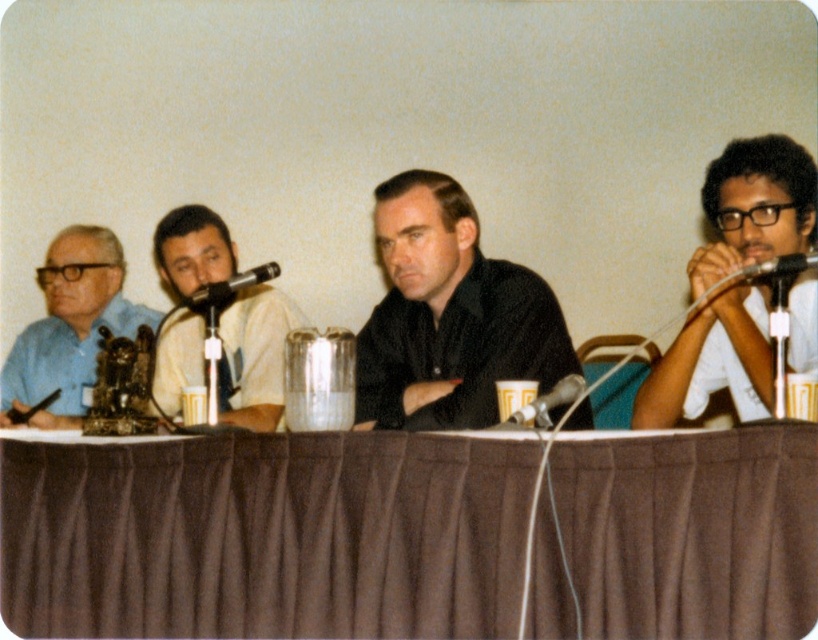
Who is more forward, (239, 362) or (754, 269)?

Point (754, 269) is in front.

Does point (241, 360) come closer to viewer compared to point (771, 269)?

No, (241, 360) is further to viewer.

This screenshot has width=818, height=640. Find the location of `white matte shirt at center`. white matte shirt at center is located at coordinates (255, 356).

In the scene shown: Can you confirm if metallic silver microphone at center is positioned above metallic silver microphone at upper right?

No, metallic silver microphone at center is not above metallic silver microphone at upper right.

Does metallic silver microphone at center appear on the right side of metallic silver microphone at upper right?

No, metallic silver microphone at center is not to the right of metallic silver microphone at upper right.

This screenshot has height=640, width=818. I want to click on metallic silver microphone at center, so click(547, 403).

Identify the location of metallic silver microphone at center. (547, 403).

Does brown fabric table at center have a larger size compared to metallic silver microphone at upper right?

Indeed, brown fabric table at center has a larger size compared to metallic silver microphone at upper right.

Which is behind, point (241, 477) or point (793, 256)?

The point (241, 477) is behind.

Who is more distant from viewer, (222, 636) or (758, 275)?

The point (758, 275) is behind.

This screenshot has height=640, width=818. Find the location of `brown fabric table at center`. brown fabric table at center is located at coordinates (264, 536).